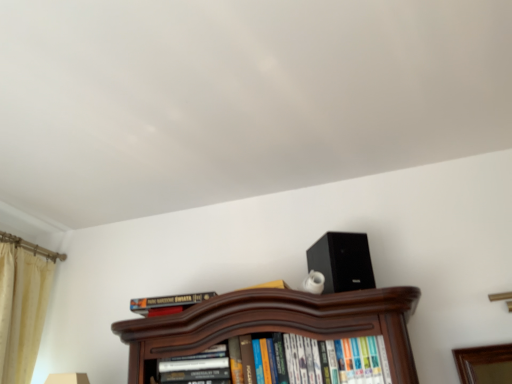
Question: Considering their positions, is hardcover book at center, marked as the 1th book in a left-to-right arrangement, located in front of or behind hardcover books at center, the 1th book from the right?

Choices:
 (A) behind
 (B) front

Answer: (A)

Question: Considering the relative positions of hardcover book at center, arranged as the third book when viewed from the right, and hardcover books at center, the 1th book from the right, in the image provided, is hardcover book at center, arranged as the third book when viewed from the right, to the left or to the right of hardcover books at center, the 1th book from the right,?

Choices:
 (A) left
 (B) right

Answer: (A)

Question: Estimate the real-world distances between objects in this image. Which object is farther from the hardcover books at center, the 1th book from the right?

Choices:
 (A) hardcover book at center, arranged as the third book when viewed from the right
 (B) hardcover book at center, positioned as the 2th book in left-to-right order
 (C) beige velvet curtain at left
 (D) black matte speaker at upper right

Answer: (C)

Question: Which is nearer to the hardcover book at center, positioned as the 2th book in left-to-right order?

Choices:
 (A) beige velvet curtain at left
 (B) black matte speaker at upper right
 (C) hardcover book at center, marked as the 1th book in a left-to-right arrangement
 (D) hardcover books at center, the 1th book from the right

Answer: (D)